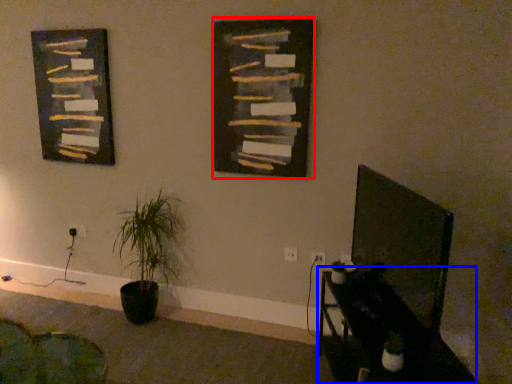
Question: Which object appears farthest to the camera in this image, bulletin board (highlighted by a red box) or table (highlighted by a blue box)?

Choices:
 (A) bulletin board
 (B) table

Answer: (A)